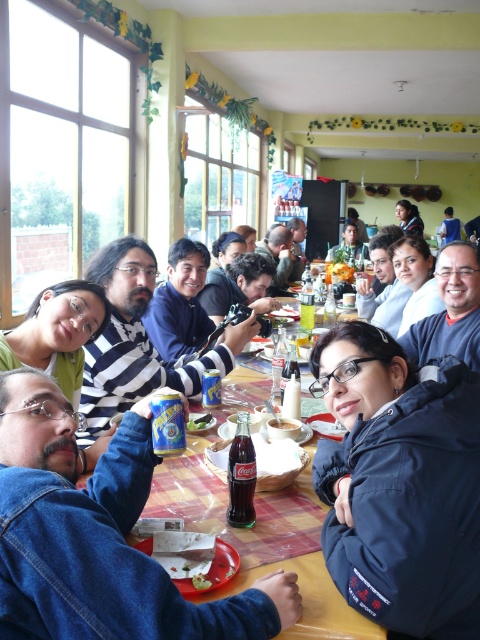
Is denim jacket at lower left above blue denim jacket at upper right?

No, denim jacket at lower left is not above blue denim jacket at upper right.

Based on the photo, can you confirm if denim jacket at lower left is taller than blue denim jacket at upper right?

In fact, denim jacket at lower left may be shorter than blue denim jacket at upper right.

Between point (40, 618) and point (445, 211), which one is positioned behind?

Point (445, 211)

Identify the location of denim jacket at lower left. (101, 540).

Who is lower down, denim jacket at lower left or white matte bowl at center?

denim jacket at lower left is below.

Find the location of a particular element. denim jacket at lower left is located at coordinates (101, 540).

Locate an element on the screen. This screenshot has width=480, height=640. denim jacket at lower left is located at coordinates (101, 540).

Locate an element on the screen. This screenshot has height=640, width=480. denim jacket at lower left is located at coordinates click(101, 540).

I want to click on denim jacket at lower left, so click(x=101, y=540).

Does point (33, 552) come farther from viewer compared to point (204, 428)?

No, (33, 552) is in front of (204, 428).

Find the location of `denim jacket at lower left`. denim jacket at lower left is located at coordinates (101, 540).